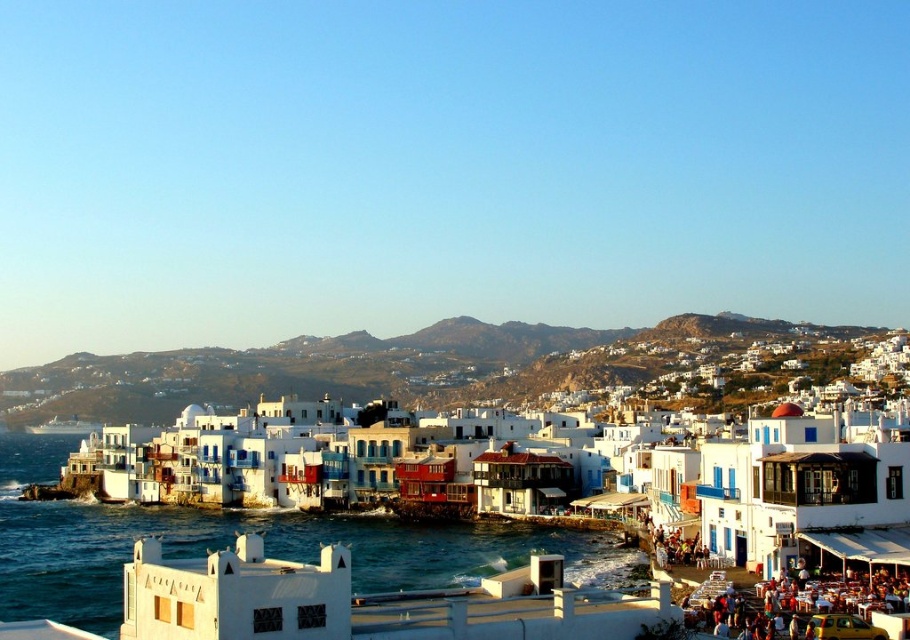
You are a tourist standing at the edge of the coastal town. You notice the white painted buildings at center and the clear blue water at lower center. Which of these two features appears taller from your viewpoint?

The white painted buildings at center has a lesser height compared to clear blue water at lower center, so the clear blue water at lower center appears taller from your viewpoint.

You are a tourist standing on the shore looking towards the town. Which of the two, the white painted buildings at center or the clear blue water at lower center, is higher in elevation?

The white painted buildings at center are higher in elevation than the clear blue water at lower center because the buildings are positioned above the water.